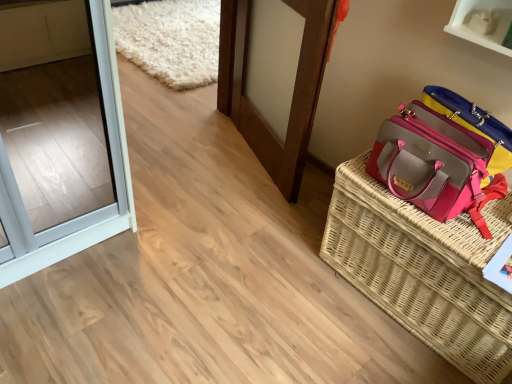
Question: Based on their sizes in the image, would you say pink woven picnic basket at right is bigger or smaller than pink fabric handbag at right?

Choices:
 (A) big
 (B) small

Answer: (A)

Question: From the image's perspective, relative to pink fabric handbag at right, is pink woven picnic basket at right above or below?

Choices:
 (A) above
 (B) below

Answer: (B)

Question: Based on their relative distances, which object is farther from the brown wooden door at center?

Choices:
 (A) pink fabric handbag at right
 (B) pink woven picnic basket at right

Answer: (B)

Question: Which object is the closest to the pink fabric handbag at right?

Choices:
 (A) pink woven picnic basket at right
 (B) brown wooden door at center

Answer: (A)